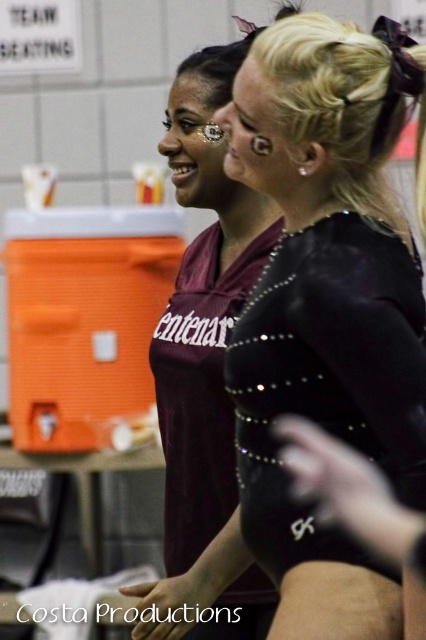
Question: Does black shiny leotard at center appear under maroon jersey at center?

Choices:
 (A) no
 (B) yes

Answer: (A)

Question: Which object appears closest to the camera in this image?

Choices:
 (A) maroon jersey at center
 (B) black shiny leotard at center

Answer: (B)

Question: Is black shiny leotard at center closer to camera compared to maroon jersey at center?

Choices:
 (A) yes
 (B) no

Answer: (A)

Question: From the image, what is the correct spatial relationship of black shiny leotard at center in relation to maroon jersey at center?

Choices:
 (A) left
 (B) right

Answer: (B)